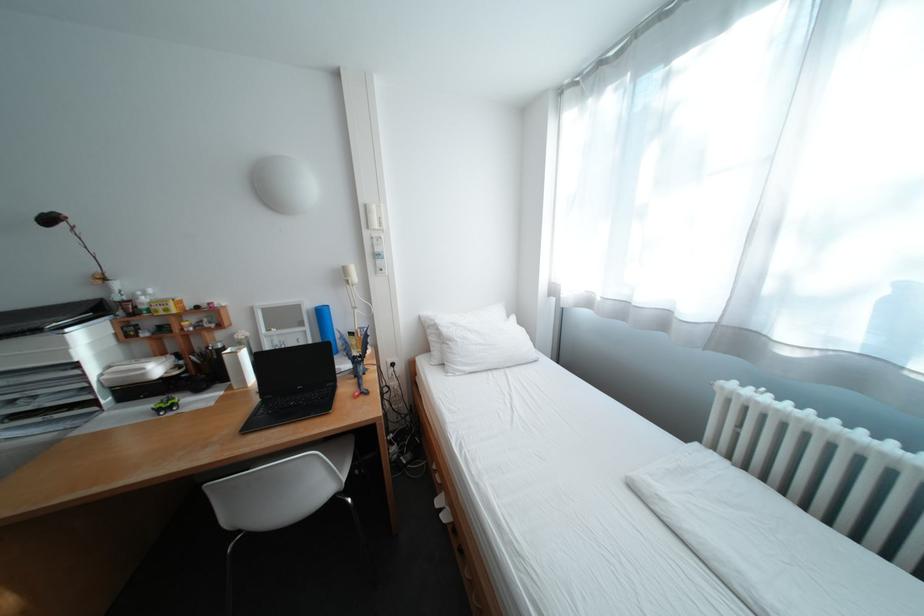
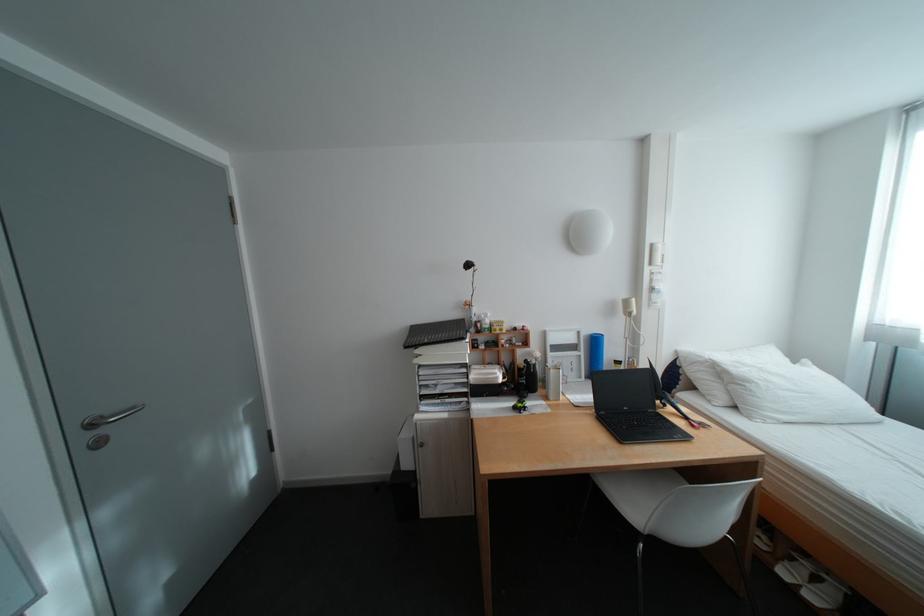
In the second image, find the point that corresponds to pixel 188 374 in the first image.

(518, 381)